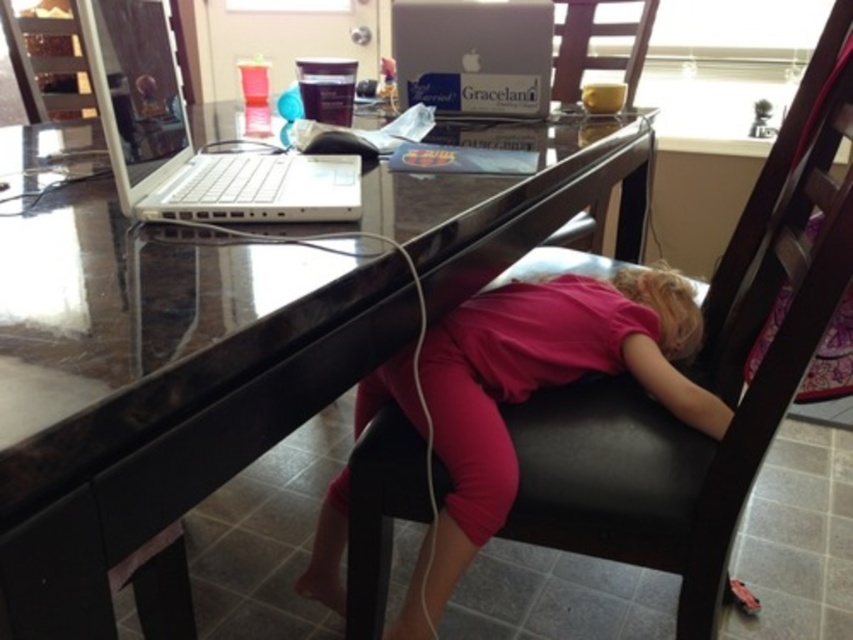
Is glossy wood table at center to the right of pink matte shirt at center from the viewer's perspective?

Incorrect, glossy wood table at center is not on the right side of pink matte shirt at center.

Does glossy wood table at center come in front of pink matte shirt at center?

Yes, glossy wood table at center is in front of pink matte shirt at center.

Locate an element on the screen. The height and width of the screenshot is (640, 853). glossy wood table at center is located at coordinates (184, 428).

Where is `glossy wood table at center`? glossy wood table at center is located at coordinates (184, 428).

Between white plastic laptop at upper left and wooden chair at upper center, which one appears on the right side from the viewer's perspective?

wooden chair at upper center is more to the right.

Is point (164, 17) closer to viewer compared to point (563, 104)?

That is True.

The height and width of the screenshot is (640, 853). In order to click on white plastic laptop at upper left in this screenshot , I will do `click(190, 141)`.

Who is shorter, black leather chair at center or wooden chair at upper center?

wooden chair at upper center is shorter.

Is point (527, 449) positioned before point (630, 58)?

Yes, it is in front of point (630, 58).

I want to click on black leather chair at center, so click(x=698, y=381).